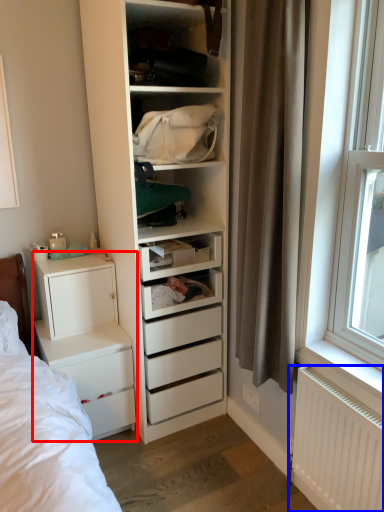
Question: Among these objects, which one is nearest to the camera, chest of drawers (highlighted by a red box) or radiator (highlighted by a blue box)?

Choices:
 (A) chest of drawers
 (B) radiator

Answer: (B)